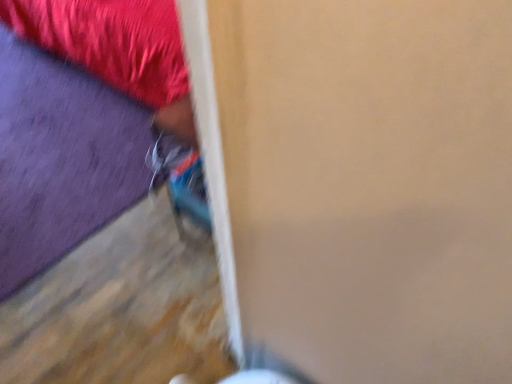
Describe the element at coordinates (116, 47) in the screenshot. I see `metallic blue phone at left` at that location.

What are the coordinates of `metallic blue phone at left` in the screenshot? It's located at (116, 47).

Locate an element on the screen. The width and height of the screenshot is (512, 384). metallic blue phone at left is located at coordinates (116, 47).